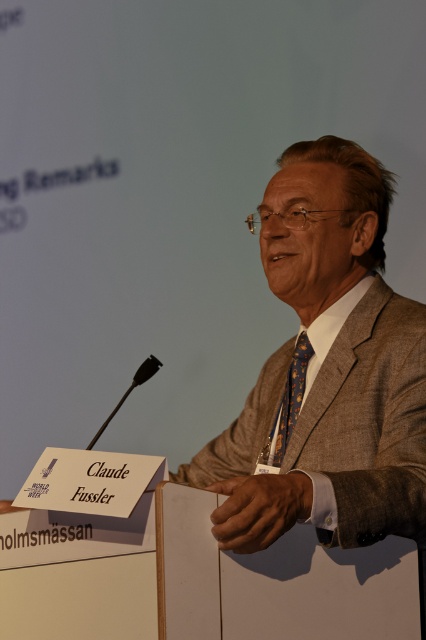
Question: Does brown textured suit at center appear under blue dotted fabric tie at center?

Choices:
 (A) yes
 (B) no

Answer: (B)

Question: Is brown textured suit at center to the left of blue dotted fabric tie at center from the viewer's perspective?

Choices:
 (A) no
 (B) yes

Answer: (B)

Question: Among these objects, which one is farthest from the camera?

Choices:
 (A) blue dotted fabric tie at center
 (B) brown textured suit at center

Answer: (A)

Question: Which point is farther to the camera?

Choices:
 (A) (282, 413)
 (B) (345, 348)

Answer: (A)

Question: Which point is farther to the camera?

Choices:
 (A) brown textured suit at center
 (B) blue dotted fabric tie at center

Answer: (B)

Question: Does brown textured suit at center appear on the left side of blue dotted fabric tie at center?

Choices:
 (A) yes
 (B) no

Answer: (A)